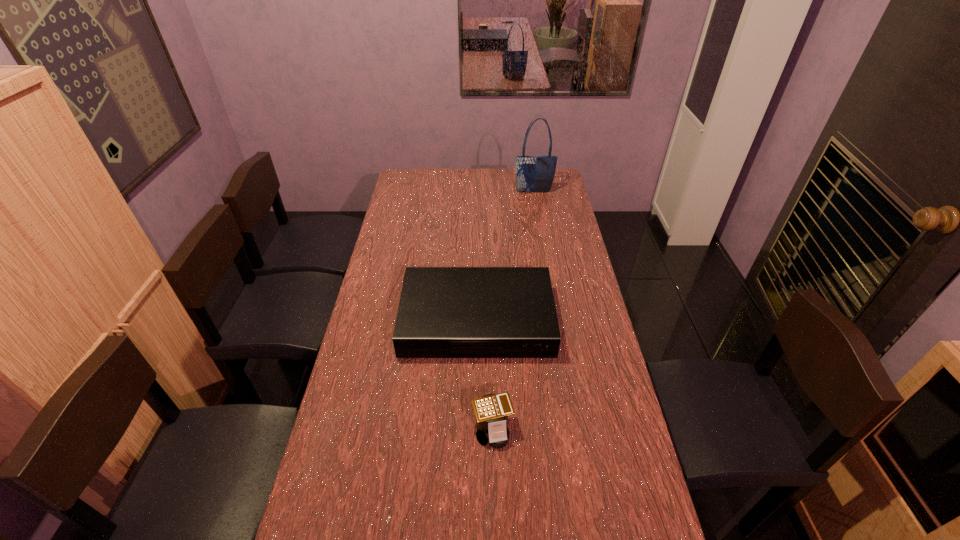
What are the coordinates of `shopping bag` in the screenshot? It's located at (533, 173).

Where is `the farthest object`? This screenshot has height=540, width=960. the farthest object is located at coordinates (533, 173).

Locate an element on the screen. This screenshot has height=540, width=960. CD player is located at coordinates (444, 312).

This screenshot has width=960, height=540. I want to click on calculator, so click(x=491, y=410).

The width and height of the screenshot is (960, 540). What are the coordinates of `free location located 0.340m on the front-facing side of the shopping bag` in the screenshot? It's located at (540, 235).

I want to click on blank area located at the front of the second nearest object for disc insertion, so click(x=476, y=435).

Identify the location of free spot located on the back of the nearest object. (491, 347).

Where is `object positioned at the far edge`? The image size is (960, 540). object positioned at the far edge is located at coordinates (533, 173).

I want to click on object that is at the left edge, so click(444, 312).

This screenshot has width=960, height=540. I want to click on object located in the right edge section of the desktop, so click(533, 173).